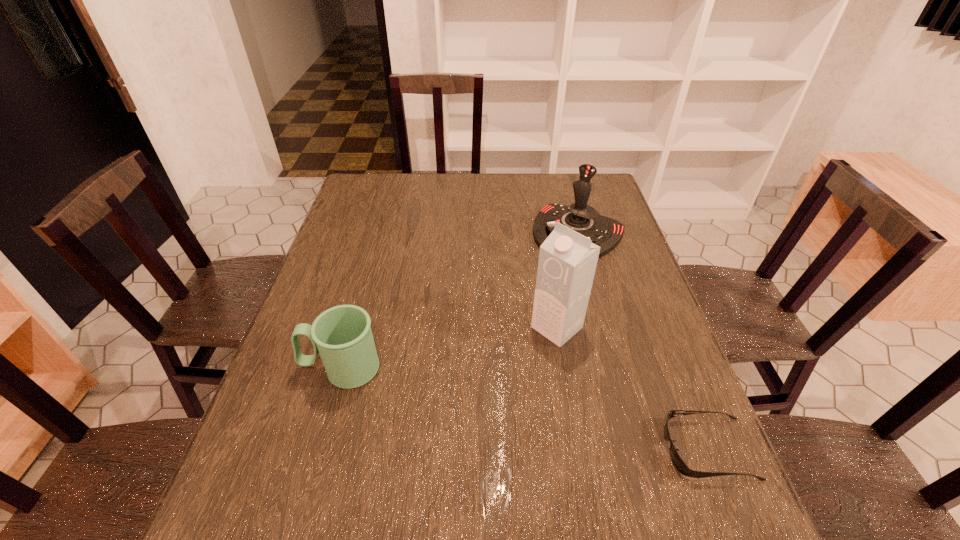
Where is `the third tallest object`? The height and width of the screenshot is (540, 960). the third tallest object is located at coordinates (342, 335).

The image size is (960, 540). I want to click on mug, so click(342, 335).

Find the location of a particular element. the shortest object is located at coordinates (681, 466).

You are a GUI agent. You are given a task and a screenshot of the screen. Output one action in this format:
    pyautogui.click(x=<x>, y=<y>)
    Task: Click on the nearest object
    The height and width of the screenshot is (540, 960).
    Given the screenshot: What is the action you would take?
    pyautogui.click(x=681, y=466)

This screenshot has height=540, width=960. Find the location of `joystick`. joystick is located at coordinates (605, 232).

Find the location of `the second tallest object`. the second tallest object is located at coordinates (605, 232).

Identify the location of the third nearest object. This screenshot has width=960, height=540. (567, 262).

Identify the location of the tallest object. (567, 262).

Find the location of a particular element. free region located on the front-facing side of the nearest object is located at coordinates (600, 449).

This screenshot has height=540, width=960. What are the coordinates of `vacant space situated on the front-facing side of the nearest object` in the screenshot? It's located at (640, 449).